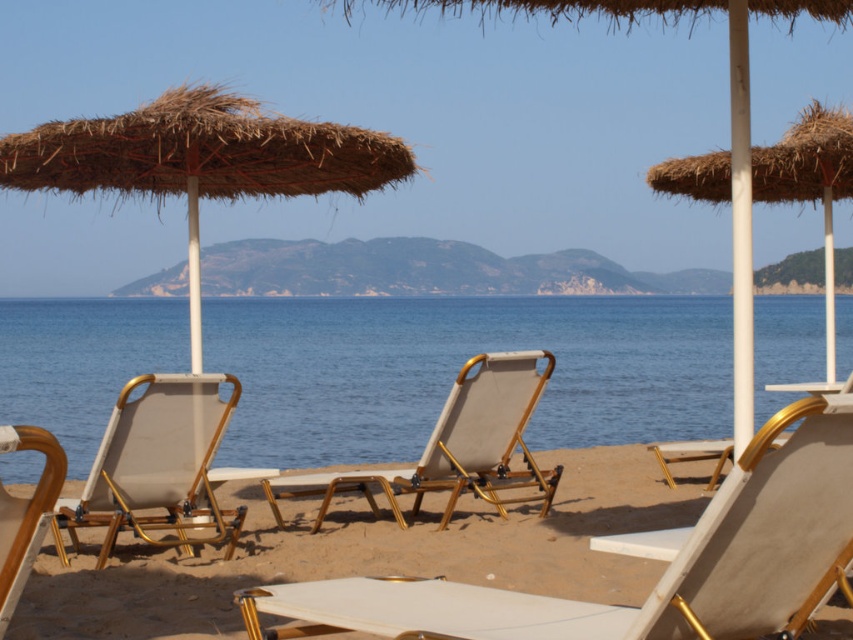
Question: Does blue water at center appear over natural straw umbrella at left?

Choices:
 (A) no
 (B) yes

Answer: (A)

Question: Which point appears closest to the camera in this image?

Choices:
 (A) (334, 172)
 (B) (277, 330)
 (C) (280, 492)
 (D) (689, 3)

Answer: (D)

Question: Does blue water at center appear under natural straw umbrella at upper right?

Choices:
 (A) no
 (B) yes

Answer: (B)

Question: Which point is farther from the camera taking this photo?

Choices:
 (A) (473, 0)
 (B) (33, 497)
 (C) (155, 182)

Answer: (C)

Question: Which point is closer to the camera?

Choices:
 (A) (833, 374)
 (B) (111, 460)

Answer: (B)

Question: In this image, where is blue water at center located relative to natural straw umbrella at upper right?

Choices:
 (A) right
 (B) left

Answer: (B)